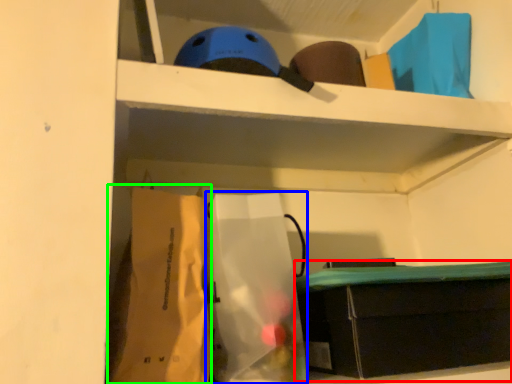
Question: Estimate the real-world distances between objects in this image. Which object is closer to furniture (highlighted by a red box), paper bag (highlighted by a blue box) or paper bag (highlighted by a green box)?

Choices:
 (A) paper bag
 (B) paper bag

Answer: (A)